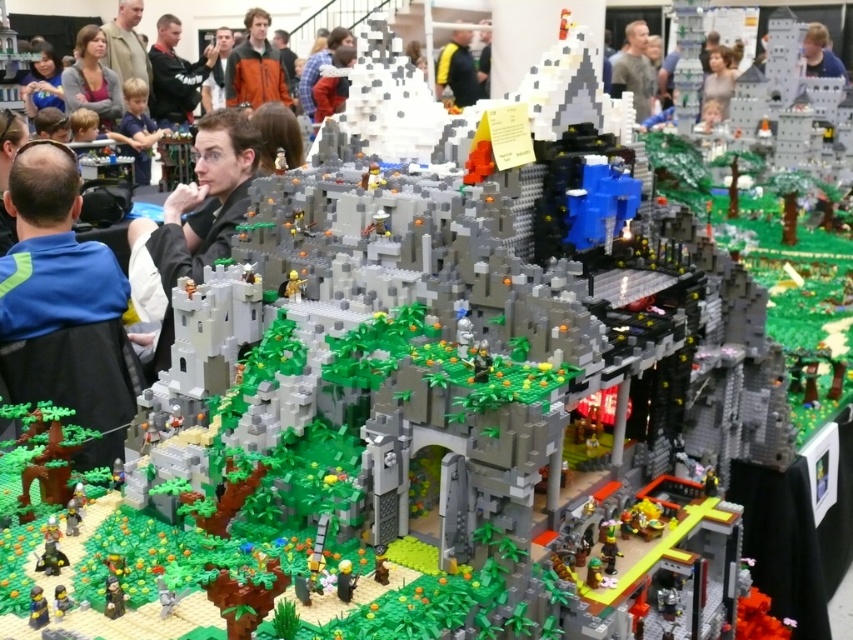
Question: Is light brown hair at upper center to the right of light brown hair at upper right from the viewer's perspective?

Choices:
 (A) yes
 (B) no

Answer: (B)

Question: Is orange fabric jacket at upper center above light brown hair at upper center?

Choices:
 (A) yes
 (B) no

Answer: (A)

Question: From the image, what is the correct spatial relationship of black matte jacket at center in relation to matte gray sweater at upper left?

Choices:
 (A) left
 (B) right

Answer: (B)

Question: Considering the real-world distances, which object is closest to the light brown hair at upper right?

Choices:
 (A) orange fabric jacket at upper center
 (B) blue fabric shirt at left
 (C) matte gray sweater at upper left
 (D) black matte jacket at center

Answer: (A)

Question: Among these objects, which one is farthest from the camera?

Choices:
 (A) orange fabric jacket at upper center
 (B) light brown hair at upper center

Answer: (A)

Question: Which of the following is the farthest from the observer?

Choices:
 (A) (91, 413)
 (B) (247, 56)
 (C) (630, 90)

Answer: (B)